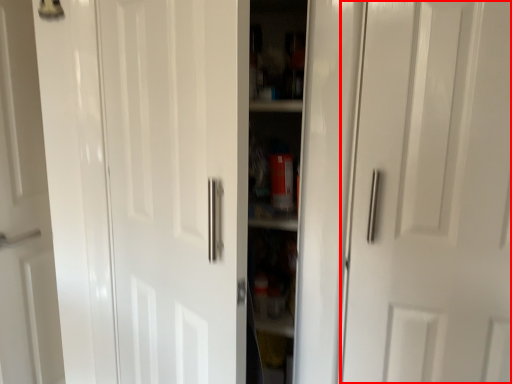
Question: From the image's perspective, where is door (annotated by the red box) located in relation to door in the image?

Choices:
 (A) below
 (B) above

Answer: (B)